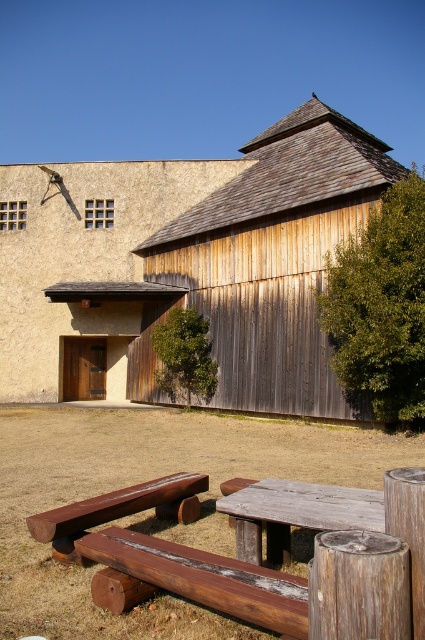
You are planning to set up a tent for a small gathering. You have a wooden picnic table at center and a wooden barn at center in the scene. Which object is positioned to the right when facing the scene?

The wooden picnic table at center is positioned to the right of the wooden barn at center.

You are standing at the picnic table and want to walk towards the wooden barn at center. Which direction should you head relative to the rustic wood bench at lower center?

You should head to the right of the rustic wood bench at lower center because the wooden barn at center is located to its right.

You are planning to set up a small garden in the area near the wooden picnic table with benches. The garden will be placed at the coordinates point (206, 579). Based on the scene description, what is the object located at those coordinates?

The point (206, 579) indicates the weathered wood bench at lower center.